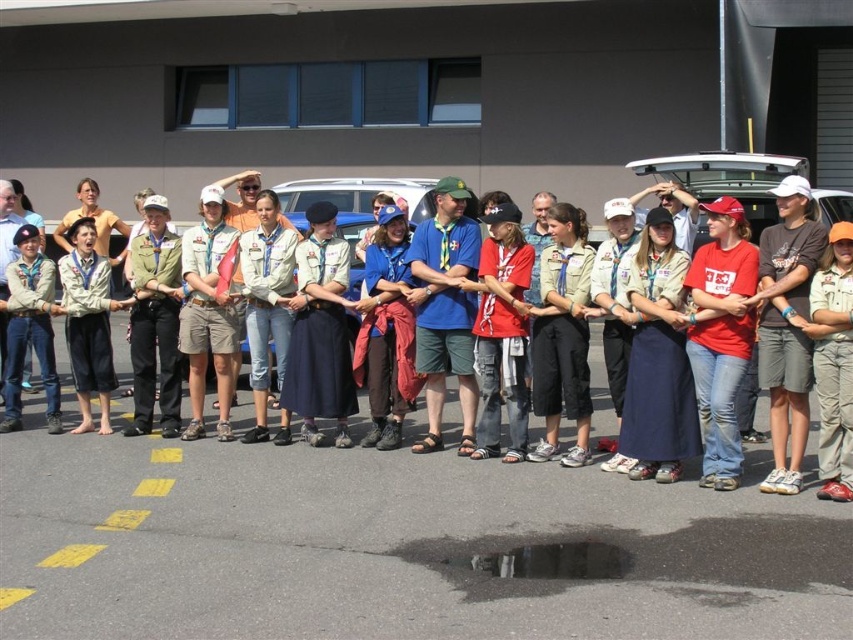
Which of these two, matte khaki shorts at center or brown cotton t-shirt at center, stands shorter?

matte khaki shorts at center is shorter.

Is matte khaki shorts at center bigger than brown cotton t-shirt at center?

Incorrect, matte khaki shorts at center is not larger than brown cotton t-shirt at center.

Is point (129, 488) positioned before point (817, 224)?

No, it is not.

This screenshot has height=640, width=853. Identify the location of matte khaki shorts at center. (328, 472).

Does blue fabric scarf at center appear on the right side of light brown uniform at left?

Correct, you'll find blue fabric scarf at center to the right of light brown uniform at left.

Who is lower down, blue fabric scarf at center or light brown uniform at left?

Positioned lower is blue fabric scarf at center.

Does point (381, 436) come closer to viewer compared to point (108, 269)?

Yes, it is.

Find the location of `blue fabric scarf at center`. blue fabric scarf at center is located at coordinates (386, 332).

Between brown cotton t-shirt at center and khaki shorts at center, which one appears on the right side from the viewer's perspective?

Positioned to the right is brown cotton t-shirt at center.

Where is `brown cotton t-shirt at center`? The width and height of the screenshot is (853, 640). brown cotton t-shirt at center is located at coordinates (787, 324).

Between point (764, 241) and point (193, 307), which one is positioned behind?

The point (193, 307) is behind.

Identify the location of brown cotton t-shirt at center. (787, 324).